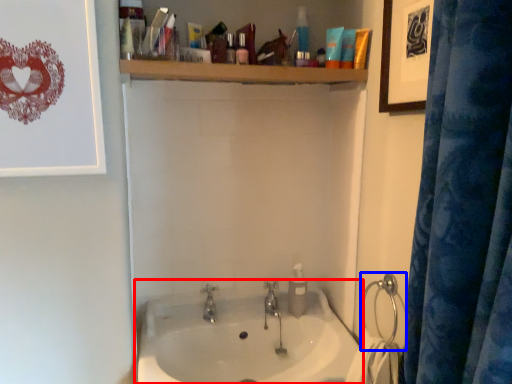
Question: Which object is closer to the camera taking this photo, sink (highlighted by a red box) or shower (highlighted by a blue box)?

Choices:
 (A) sink
 (B) shower

Answer: (A)